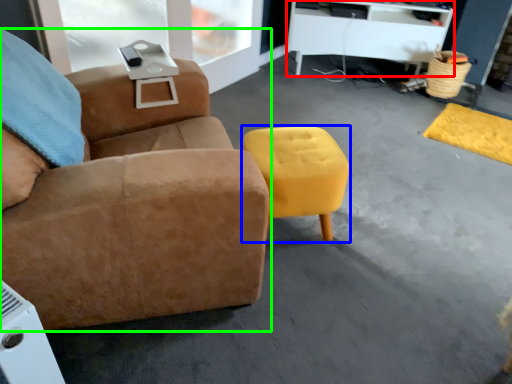
Question: Estimate the real-world distances between objects in this image. Which object is closer to desk (highlighted by a red box), stool (highlighted by a blue box) or chair (highlighted by a green box)?

Choices:
 (A) stool
 (B) chair

Answer: (A)